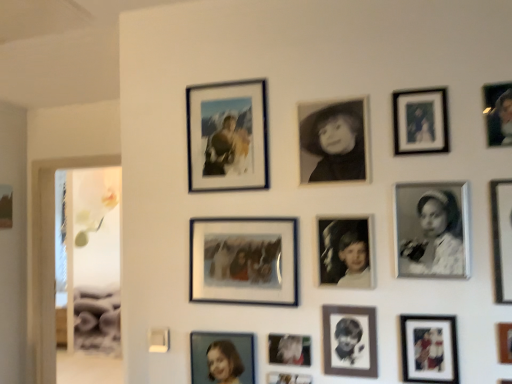
Question: Considering the positions of point (231, 342) and point (230, 135), is point (231, 342) closer or farther from the camera than point (230, 135)?

Choices:
 (A) farther
 (B) closer

Answer: (B)

Question: In terms of size, does matte blue photo frame at lower center, acting as the 3th picture frame starting from the back, appear bigger or smaller than matte glass photo frame at upper center, the thirteenth picture frame positioned from the front?

Choices:
 (A) small
 (B) big

Answer: (A)

Question: Based on their relative distances, which object is nearer to the matte black portrait at upper right, the thirteenth picture frame in the back-to-front sequence?

Choices:
 (A) black matte portrait at center, the 7th picture frame viewed from the back
 (B) metallic silver photo frame at lower center, the 5th picture frame positioned from the left
 (C) black paper portrait at center, which is counted as the 9th picture frame, starting from the left
 (D) metallic silver photo frame at lower center, which is counted as the 9th picture frame, starting from the front
 (E) matte black photo frame at left, acting as the fourteenth picture frame starting from the right

Answer: (A)

Question: Which object is positioned closest to the matte black photo frame at left, which is counted as the first picture frame, starting from the left?

Choices:
 (A) matte black portrait at upper right, which appears as the second picture frame when viewed from the right
 (B) matte blue photo frame at lower center, which appears as the 12th picture frame when viewed from the front
 (C) black matte photo frame at center-right, the 12th picture frame when ordered from left to right
 (D) black matte photo at center, which is the 8th picture frame from back to front
 (E) metallic silver photo frame at lower center, the sixth picture frame in the back-to-front sequence

Answer: (B)